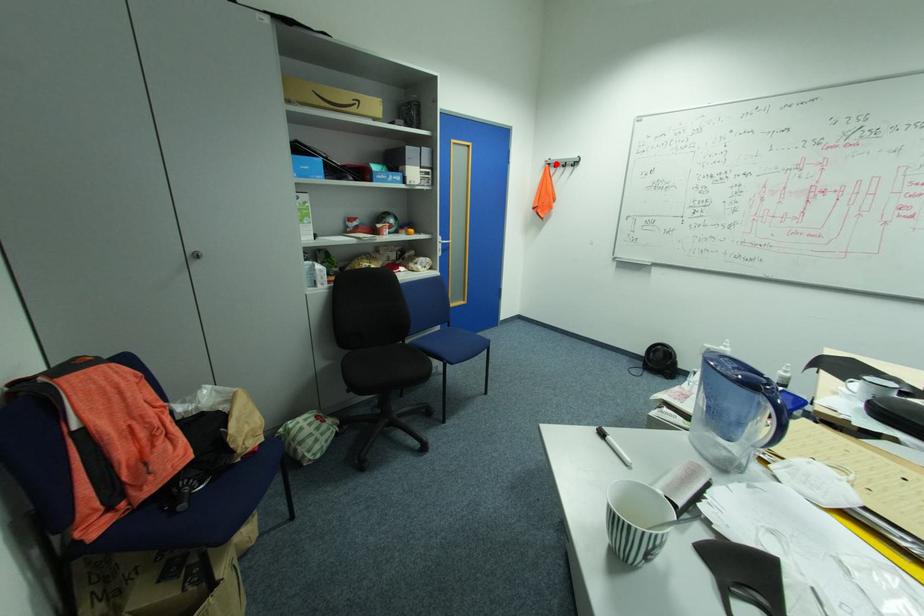
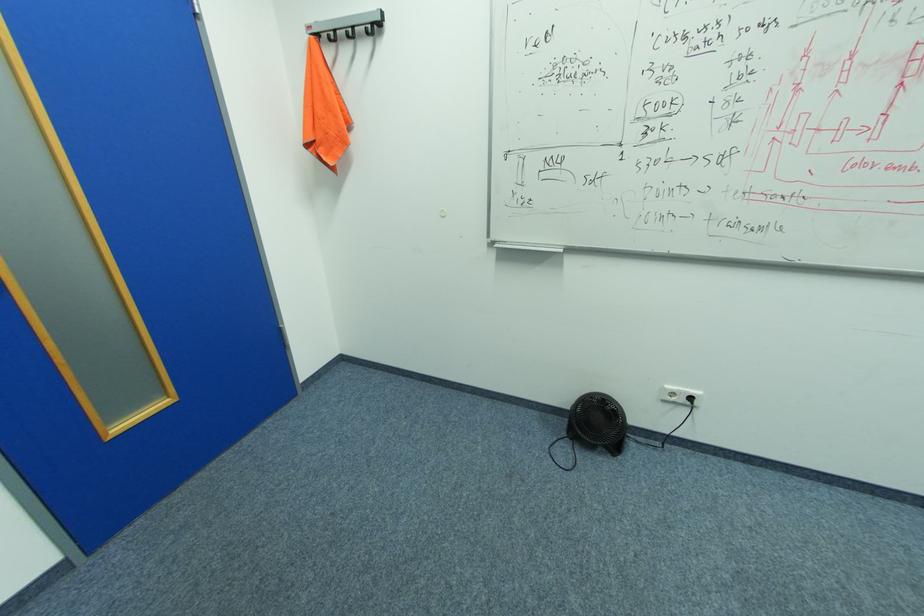
Question: I am providing you with two images of the same scene from different viewpoints. In image1, a red point is highlighted. Considering the same 3D point in image2, which of the following is correct?

Choices:
 (A) It is closer
 (B) It is farther

Answer: (B)